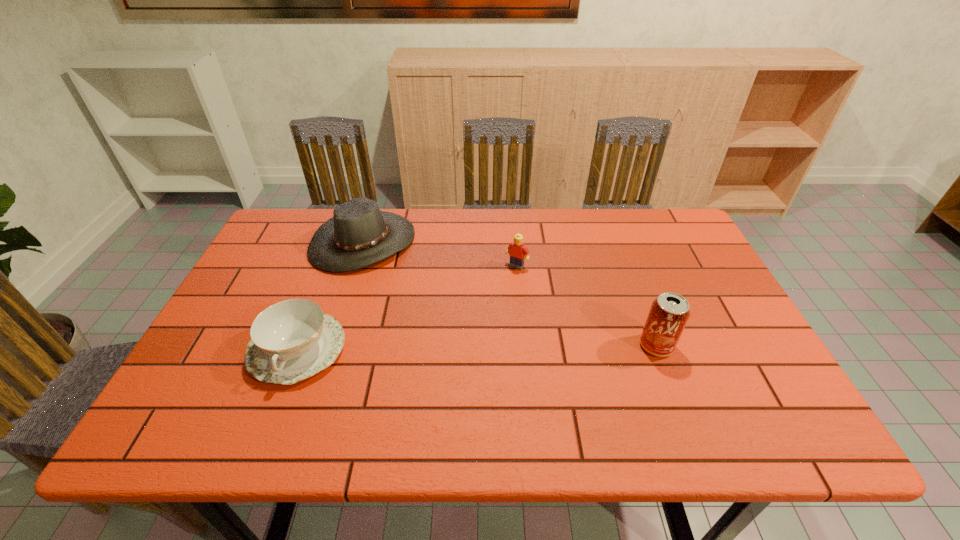
Find the location of `vacant space located on the front-facing side of the hat`. vacant space located on the front-facing side of the hat is located at coordinates (419, 286).

This screenshot has width=960, height=540. In order to click on free space located 0.280m on the front-facing side of the hat in this screenshot , I will do `click(457, 316)`.

The image size is (960, 540). In order to click on object positioned at the far edge in this screenshot , I will do `click(359, 234)`.

You are a GUI agent. You are given a task and a screenshot of the screen. Output one action in this format:
    pyautogui.click(x=<x>, y=<y>)
    Task: Click on the object that is at the near edge
    
    Given the screenshot: What is the action you would take?
    pyautogui.click(x=292, y=340)

Identify the location of chinaware positioned at the left edge. [x=292, y=340].

Identify the location of hat at the left edge. (359, 234).

This screenshot has height=540, width=960. I want to click on object located at the far left corner, so click(x=359, y=234).

At what (x,y) coordinates should I click in order to perform the action: click on object present at the near left corner. Please return your answer as a coordinate pair (x, y). Looking at the image, I should click on (292, 340).

This screenshot has height=540, width=960. In the image, there is a desktop. What are the coordinates of `free space at the far edge` in the screenshot? It's located at (541, 246).

You are a GUI agent. You are given a task and a screenshot of the screen. Output one action in this format:
    pyautogui.click(x=<x>, y=<y>)
    Task: Click on the vacant space at the near edge
    
    Given the screenshot: What is the action you would take?
    pyautogui.click(x=310, y=397)